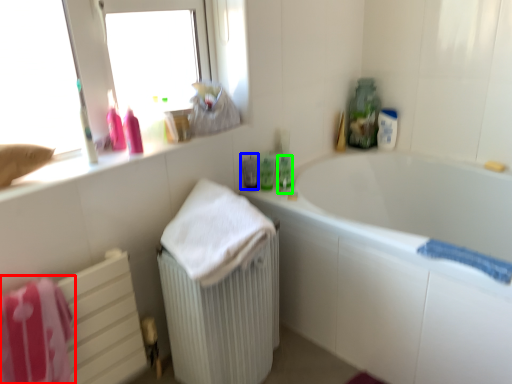
Question: Considering the real-world distances, which object is closest to bath towel (highlighted by a red box)? mouthwash (highlighted by a blue box) or mouthwash (highlighted by a green box).

Choices:
 (A) mouthwash
 (B) mouthwash

Answer: (A)